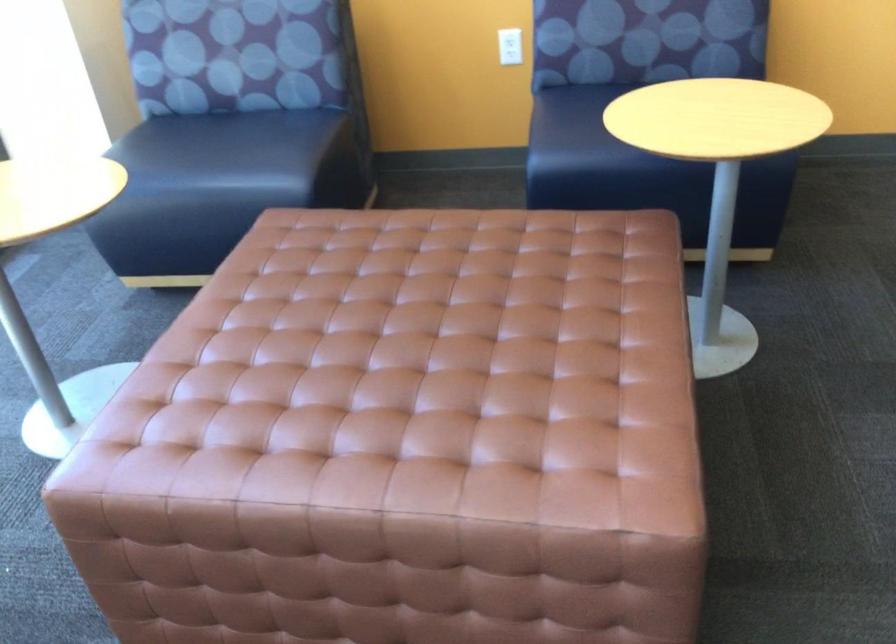
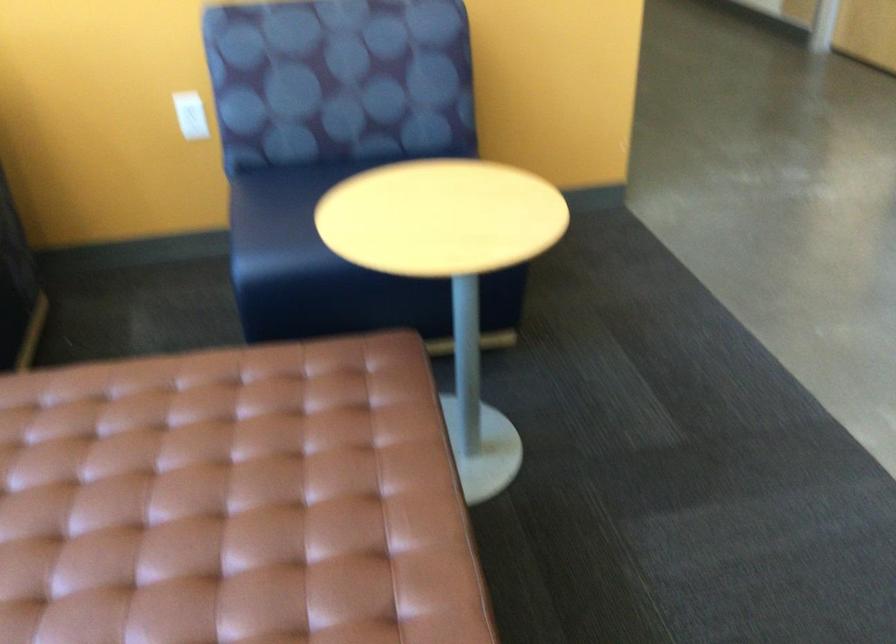
In the second image, find the point that corresponds to point 574,120 in the first image.

(282, 210)